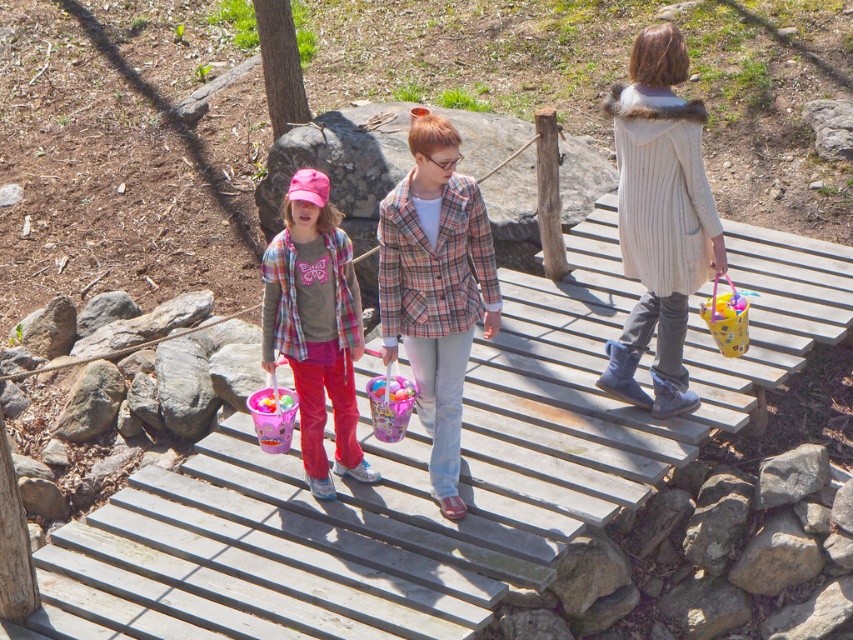
Which is above, plaid fabric shirt at center or translucent plastic bucket at center?

plaid fabric shirt at center is above.

Is plaid fabric shirt at center bigger than translucent plastic bucket at center?

Correct, plaid fabric shirt at center is larger in size than translucent plastic bucket at center.

Is point (300, 324) closer to camera compared to point (294, 412)?

Yes, point (300, 324) is closer to viewer.

Find the location of a particular element. The width and height of the screenshot is (853, 640). plaid fabric shirt at center is located at coordinates (315, 326).

Does wooden bridge at center appear on the right side of translucent plastic basket at center?

Indeed, wooden bridge at center is positioned on the right side of translucent plastic basket at center.

Is wooden bridge at center wider than translucent plastic basket at center?

Yes, wooden bridge at center is wider than translucent plastic basket at center.

Is point (601, 403) more distant than point (386, 392)?

Yes, point (601, 403) is behind point (386, 392).

The height and width of the screenshot is (640, 853). Find the location of `wooden bridge at center`. wooden bridge at center is located at coordinates (422, 481).

The height and width of the screenshot is (640, 853). Identify the location of translucent yellow bucket at center. (726, 320).

Can you confirm if translucent yellow bucket at center is positioned below translucent plastic basket at center?

Incorrect, translucent yellow bucket at center is not positioned below translucent plastic basket at center.

Is point (714, 291) farther from viewer compared to point (392, 422)?

That is True.

You are a GUI agent. You are given a task and a screenshot of the screen. Output one action in this format:
    pyautogui.click(x=<x>, y=<y>)
    Task: Click on the translucent yellow bucket at center
    Image resolution: width=853 pixels, height=640 pixels.
    Given the screenshot: What is the action you would take?
    pyautogui.click(x=726, y=320)